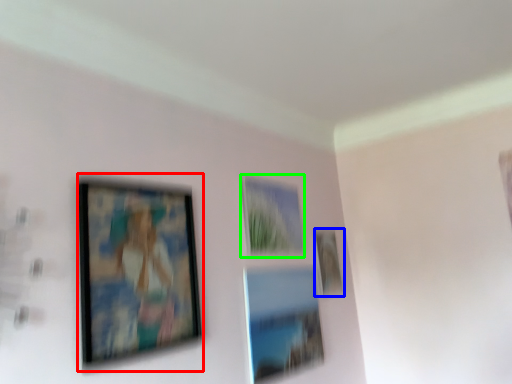
Question: Estimate the real-world distances between objects in this image. Which object is farther from picture frame (highlighted by a red box), picture frame (highlighted by a blue box) or picture frame (highlighted by a green box)?

Choices:
 (A) picture frame
 (B) picture frame

Answer: (A)